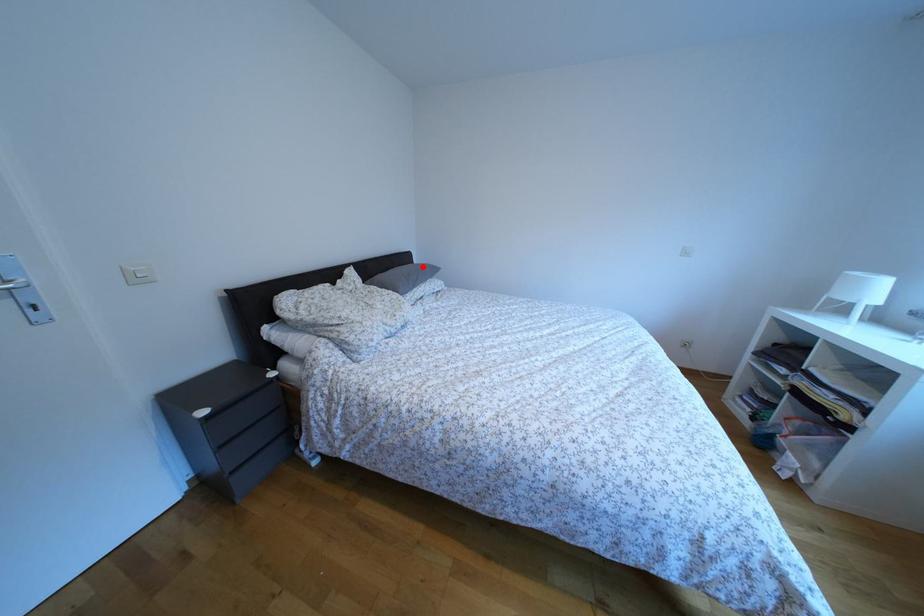
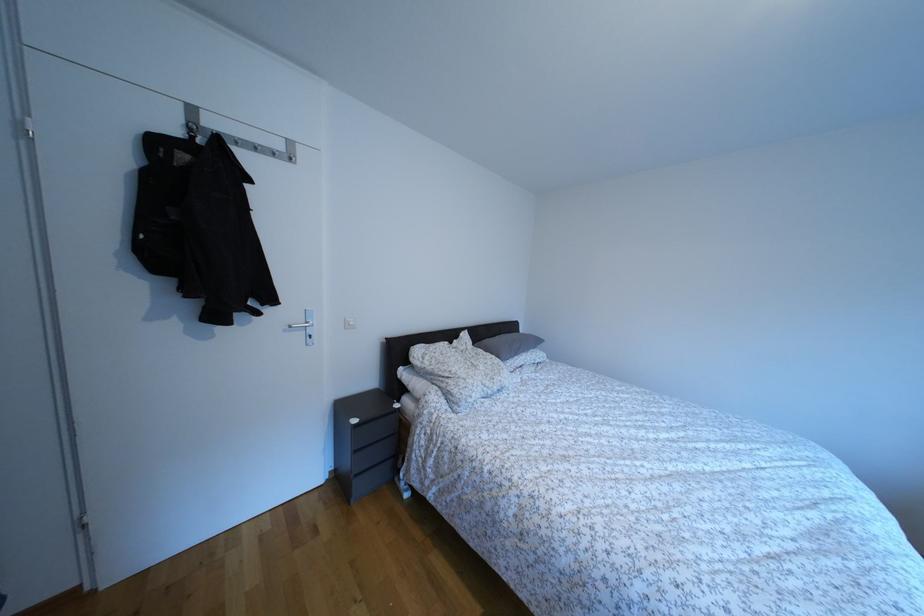
Question: I am providing you with two images of the same scene from different viewpoints. A red point is shown in image1. For the corresponding object point in image2, is it positioned nearer or farther from the camera?

Choices:
 (A) Nearer
 (B) Farther

Answer: (B)